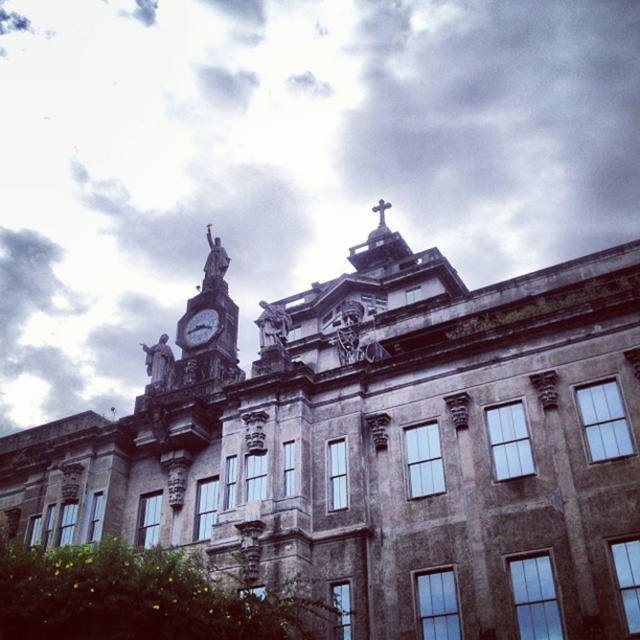
Which is above, white cloudy sky at upper center or metallic gray clock at upper center?

white cloudy sky at upper center is above.

Does white cloudy sky at upper center lie in front of metallic gray clock at upper center?

No, white cloudy sky at upper center is further to the viewer.

This screenshot has height=640, width=640. Describe the element at coordinates (285, 157) in the screenshot. I see `white cloudy sky at upper center` at that location.

Where is `white cloudy sky at upper center`? Image resolution: width=640 pixels, height=640 pixels. white cloudy sky at upper center is located at coordinates (285, 157).